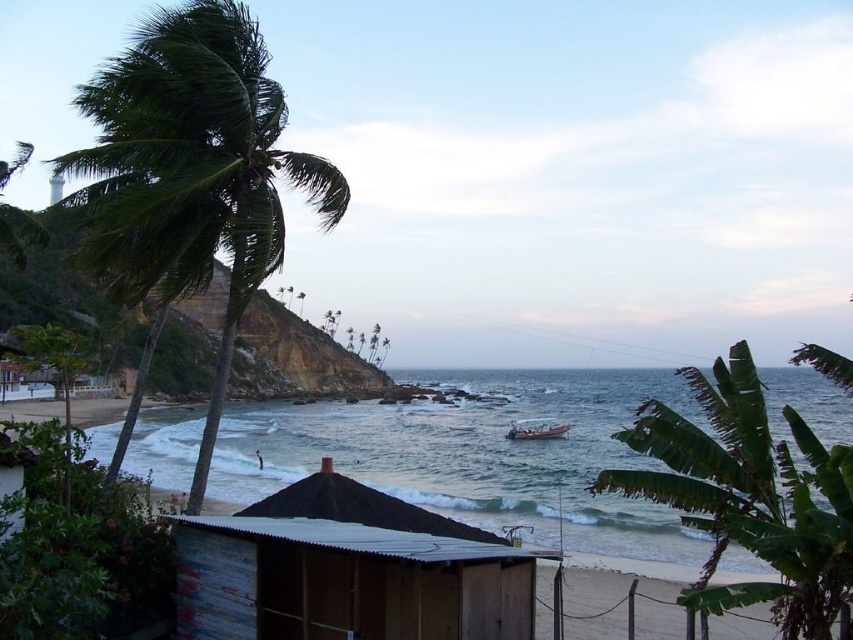
Question: Can you confirm if clear blue water at center is wider than metallic silver boat at center?

Choices:
 (A) no
 (B) yes

Answer: (B)

Question: Is clear blue water at center thinner than green leafy palm tree at left?

Choices:
 (A) yes
 (B) no

Answer: (B)

Question: Which of the following is the closest to the observer?

Choices:
 (A) metallic silver boat at center
 (B) green leafy palm tree at right
 (C) green leafy palm tree at left
 (D) rusty corrugated metal hut at center

Answer: (B)

Question: Is clear blue water at center in front of green leafy palm tree at right?

Choices:
 (A) yes
 (B) no

Answer: (B)

Question: Which point appears closest to the camera in this image?

Choices:
 (A) (380, 442)
 (B) (732, 465)
 (C) (190, 536)

Answer: (B)

Question: Which of the following is the closest to the observer?

Choices:
 (A) (837, 493)
 (B) (189, 244)

Answer: (A)